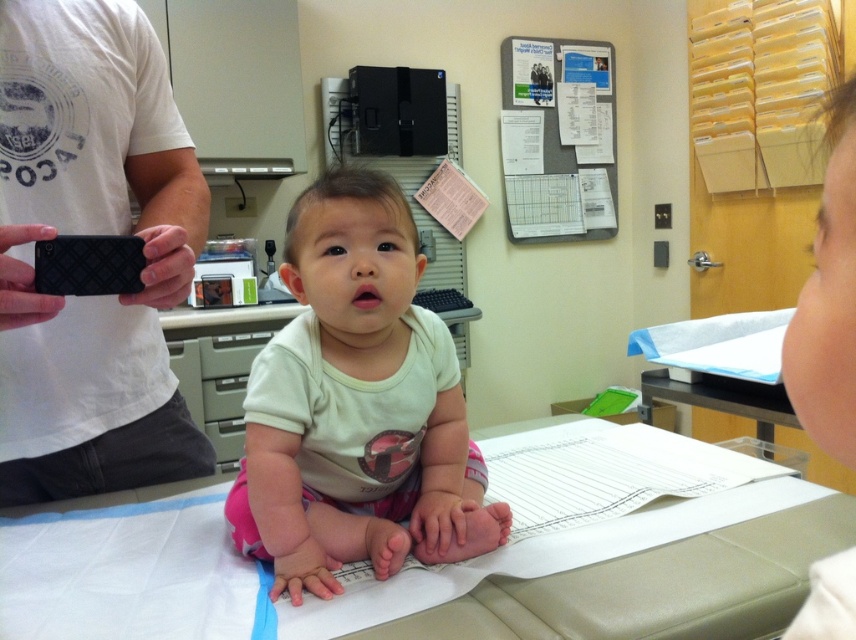
You are a GUI agent. You are given a task and a screenshot of the screen. Output one action in this format:
    pyautogui.click(x=<x>, y=<y>)
    Task: Click on the black quilted phone at left
    
    Given the screenshot: What is the action you would take?
    pyautogui.click(x=94, y=234)

Is point (45, 486) positioned in front of point (302, 566)?

No, (45, 486) is further to viewer.

Identify the location of black quilted phone at left. The height and width of the screenshot is (640, 856). (94, 234).